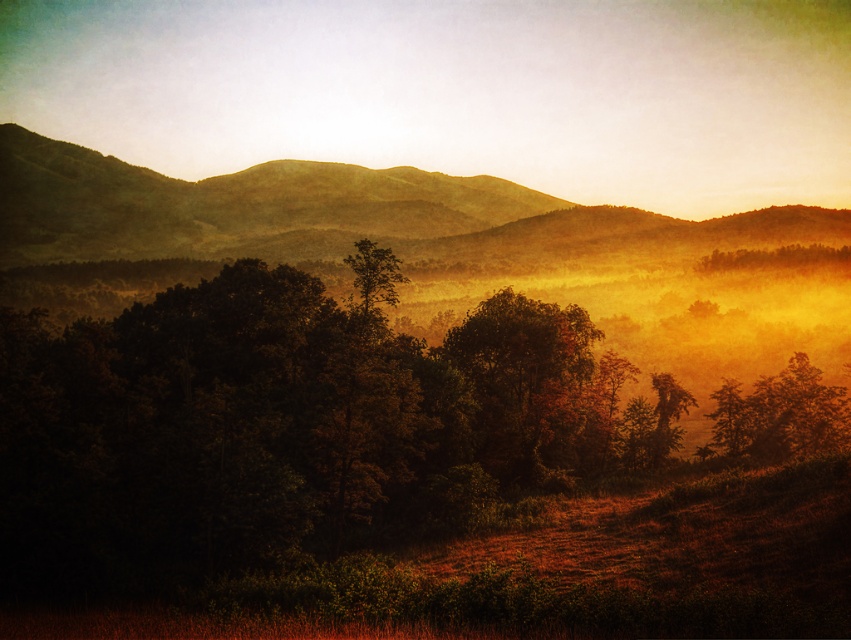
You are an artist setting up your easel to paint the scene. You want to ensure that the dark green foliage at center and the green matte tree at center are positioned correctly in your painting. Based on the scene description, which object should you place to the left in your painting?

The dark green foliage at center should be placed to the left of the green matte tree at center as per the description.

You are an observer standing in the field looking at the dark green foliage at center and the green matte tree at center. Which object is taller?

The dark green foliage at center is taller than the green matte tree at center.